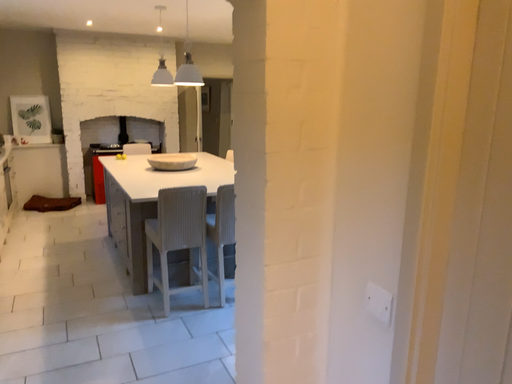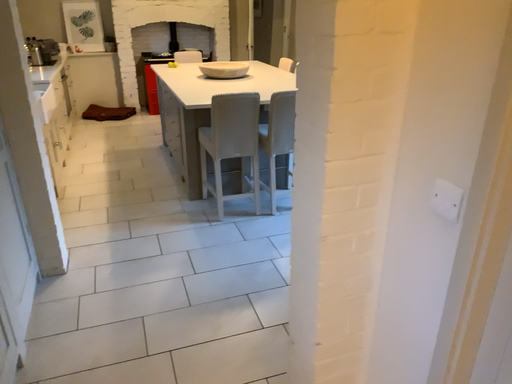
Question: Which way did the camera rotate in the video?

Choices:
 (A) rotated right
 (B) rotated left

Answer: (B)